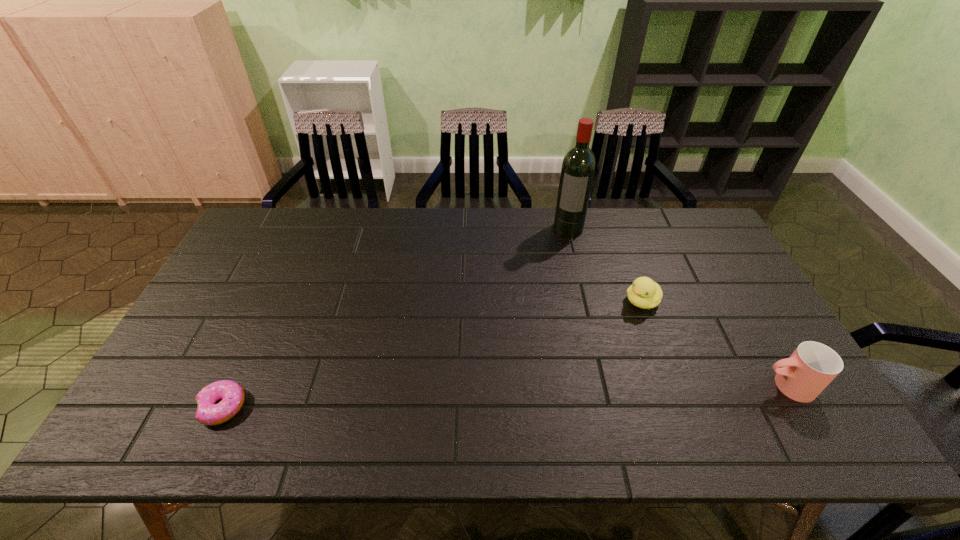
The height and width of the screenshot is (540, 960). I want to click on the leftmost object, so click(x=231, y=394).

Identify the location of doughnut. The height and width of the screenshot is (540, 960). (231, 394).

You are a GUI agent. You are given a task and a screenshot of the screen. Output one action in this format:
    pyautogui.click(x=<x>, y=<y>)
    Task: Click on the cup
    Image resolution: width=960 pixels, height=540 pixels.
    Given the screenshot: What is the action you would take?
    pyautogui.click(x=809, y=370)

Locate an element on the screen. the rightmost object is located at coordinates (809, 370).

This screenshot has height=540, width=960. I want to click on the second object from left to right, so click(578, 168).

What are the coordinates of `wine bottle` in the screenshot? It's located at (578, 168).

Where is `the third nearest object`? Image resolution: width=960 pixels, height=540 pixels. the third nearest object is located at coordinates (644, 293).

The width and height of the screenshot is (960, 540). I want to click on duckling, so click(x=644, y=293).

Where is `blank area located 0.350m on the right of the shortest object`? The width and height of the screenshot is (960, 540). blank area located 0.350m on the right of the shortest object is located at coordinates (395, 407).

The width and height of the screenshot is (960, 540). I want to click on vacant space located 0.110m on the side of the second tallest object with the handle, so click(714, 386).